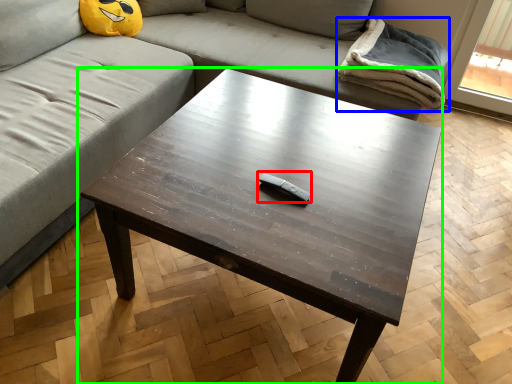
Question: Which object is positioned farthest from Wii controller (highlighted by a red box)? Select from blanket (highlighted by a blue box) and coffee table (highlighted by a green box).

Choices:
 (A) blanket
 (B) coffee table

Answer: (A)